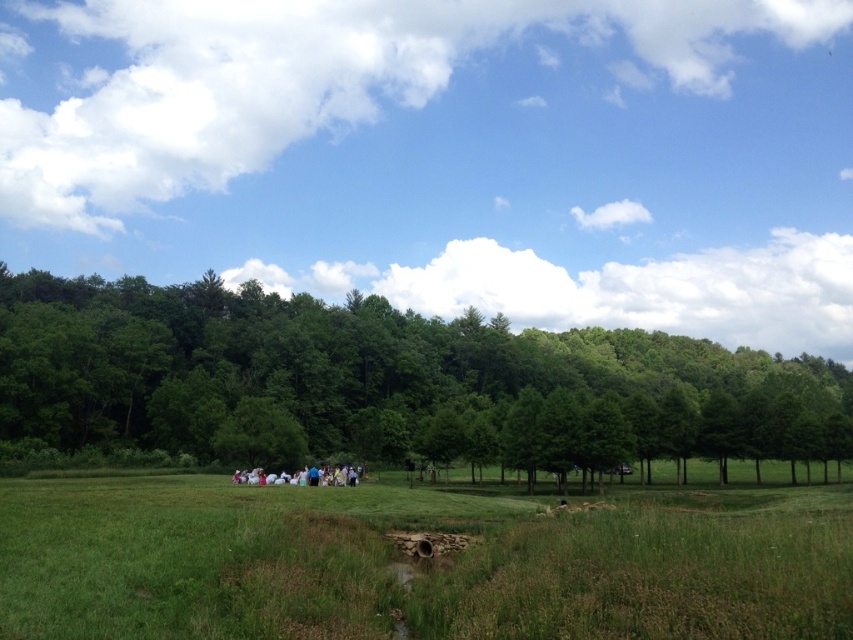
You are standing in the middle of the grassy field looking towards the dense line of trees. There are two points marked in the scene. The first point is at coordinate point (828, 371) and the second is at point (256, 481). Which point is closer to you?

Point (828, 371) is further to the viewer than point (256, 481), so the second point is closer to you.

You are standing at the point marked by point (392,385) in the image. What is the nearest object to you in the scene?

The nearest object to you at point (392,385) is the green leafy tree at center.

Where is the green grassy field at center located in the image?

The green grassy field at center is located at point (x=418, y=563) in the image.